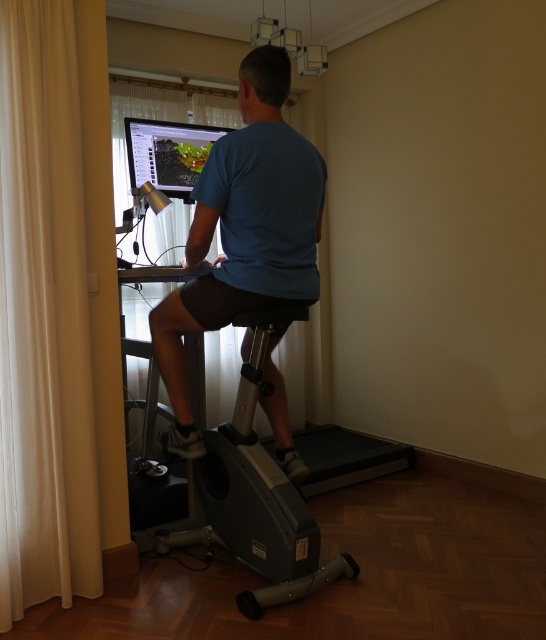
Question: Is white fabric curtain at left thinner than blue matte shirt at center?

Choices:
 (A) yes
 (B) no

Answer: (A)

Question: Does white fabric curtain at left have a greater width compared to blue matte shirt at center?

Choices:
 (A) yes
 (B) no

Answer: (B)

Question: Is white fabric curtain at left thinner than blue matte shirt at center?

Choices:
 (A) no
 (B) yes

Answer: (B)

Question: Which point is closer to the camera?

Choices:
 (A) (269, 216)
 (B) (9, 419)

Answer: (A)

Question: Which of the following is the farthest from the observer?

Choices:
 (A) pos(182,305)
 (B) pos(21,544)

Answer: (B)